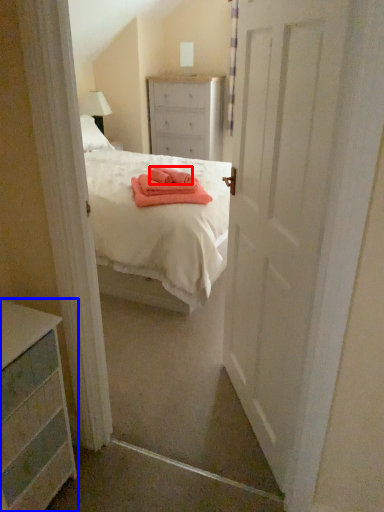
Question: Which of the following is the closest to the observer, cloth (highlighted by a red box) or chest of drawers (highlighted by a blue box)?

Choices:
 (A) cloth
 (B) chest of drawers

Answer: (B)